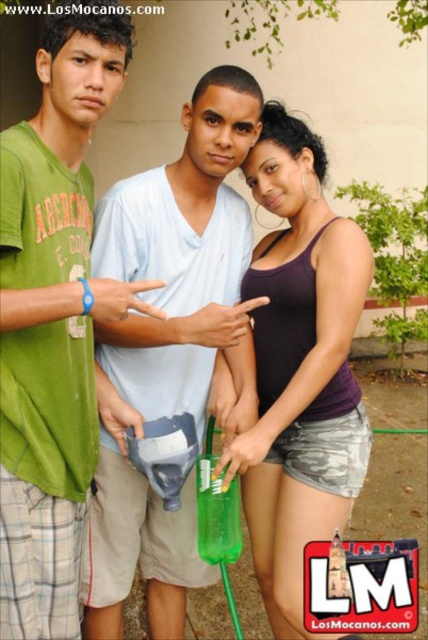
Question: Can you confirm if light blue cotton shirt at center is smaller than purple matte tank top at center?

Choices:
 (A) yes
 (B) no

Answer: (B)

Question: Which point is farther from the camera taking this photo?

Choices:
 (A) (285, 109)
 (B) (109, 83)
 (C) (208, 272)

Answer: (A)

Question: Can you confirm if green fabric shirt at left is positioned above purple matte tank top at center?

Choices:
 (A) no
 (B) yes

Answer: (B)

Question: In this image, where is green fabric shirt at left located relative to purple matte tank top at center?

Choices:
 (A) above
 (B) below

Answer: (A)

Question: Among these points, which one is farthest from the camera?

Choices:
 (A) (38, 512)
 (B) (122, 499)

Answer: (B)

Question: Which object appears farthest from the camera in this image?

Choices:
 (A) purple matte tank top at center
 (B) green fabric shirt at left

Answer: (A)